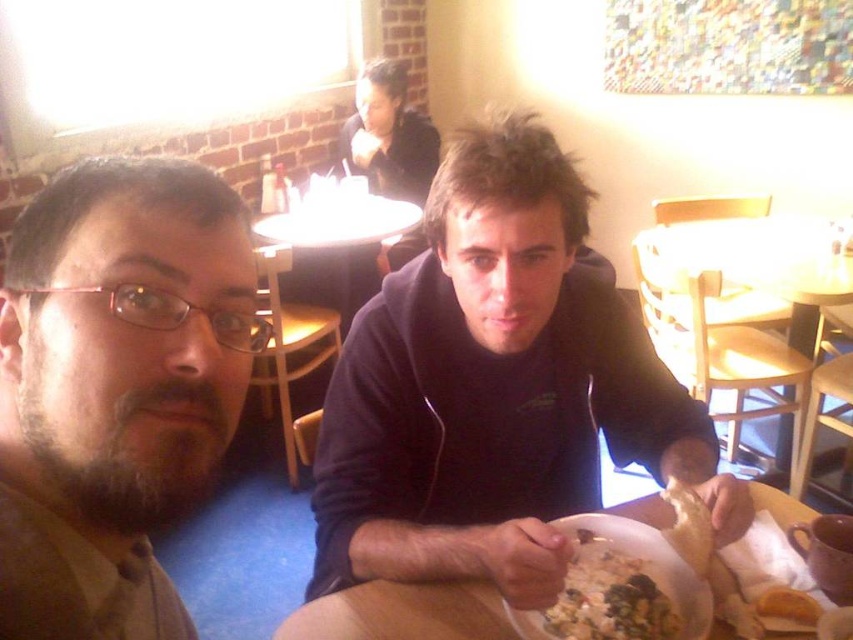
You are a server at the restaurant and need to place a new dish on the table between the dark blue hoodie at center and the white creamy pasta at lower center. Considering their heights, which object should you avoid placing the dish closer to to prevent blocking the view of the taller object?

The dark blue hoodie at center is taller than the white creamy pasta at lower center. To prevent blocking the view of the taller object, you should avoid placing the dish closer to the dark blue hoodie at center.